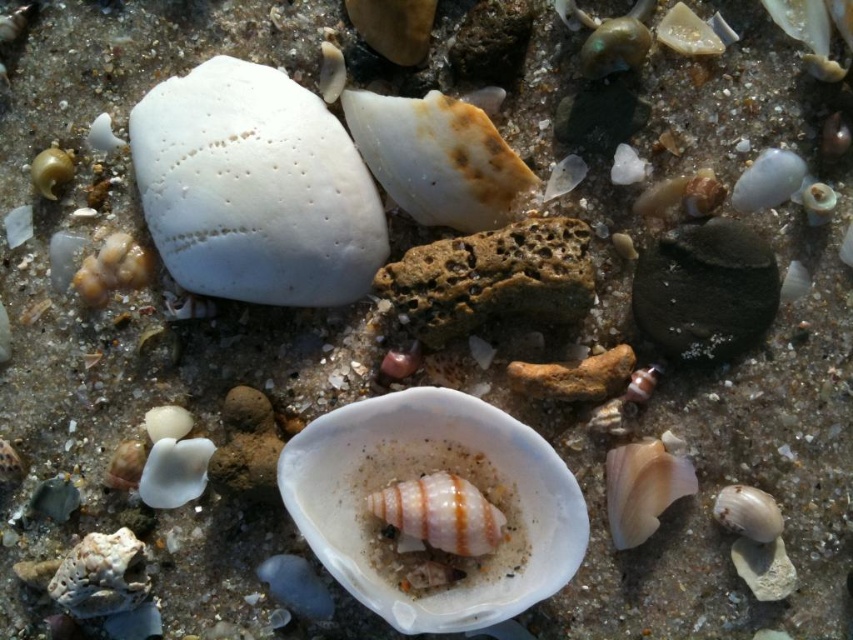
You are an artist creating a detailed sketch of the scene. You need to place the white matte shell at upper left accurately. According to the coordinates provided, where should you position it on your drawing canvas?

The white matte shell at upper left should be positioned at coordinates approximately 0.295 on the x and 0.299 on the y axis.

You are an artist creating a sculpture and need to determine which object is taller for a specific design element. Given the white matte shell at upper left and the pink glossy snail at center, which one should you choose if you need the taller object?

The white matte shell at upper left is taller than the pink glossy snail at center, so you should choose the white matte shell at upper left for the taller design element.